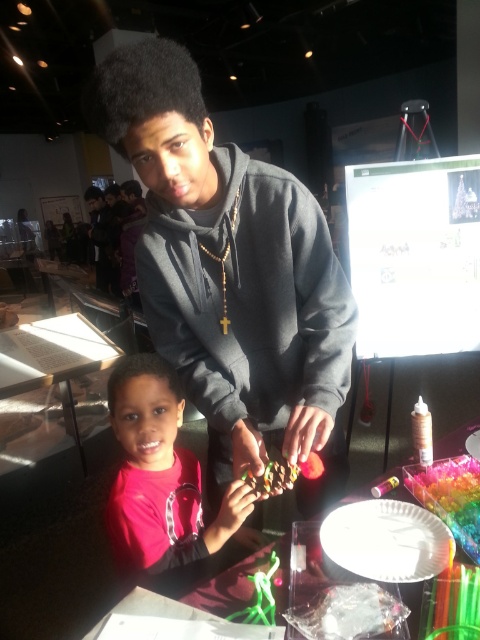
Question: Which point is farther to the camera?

Choices:
 (A) (59, 369)
 (B) (469, 481)
 (C) (337, 305)

Answer: (A)

Question: Is the position of smooth plastic table at center less distant than that of translucent plastic beads at lower right?

Choices:
 (A) no
 (B) yes

Answer: (B)

Question: Is smooth plastic table at center wider than translucent plastic beads at lower right?

Choices:
 (A) yes
 (B) no

Answer: (A)

Question: Based on their relative distances, which object is farther from the dark gray hoodie at upper center?

Choices:
 (A) transparent glass table at lower left
 (B) smooth plastic table at center
 (C) matte black hoodie at upper center

Answer: (C)

Question: Which is nearer to the translucent plastic beads at lower right?

Choices:
 (A) transparent glass table at lower left
 (B) matte red shirt at center
 (C) shiny chocolate at lower center

Answer: (C)

Question: Does smooth plastic table at center have a larger size compared to matte black hoodie at upper center?

Choices:
 (A) no
 (B) yes

Answer: (A)